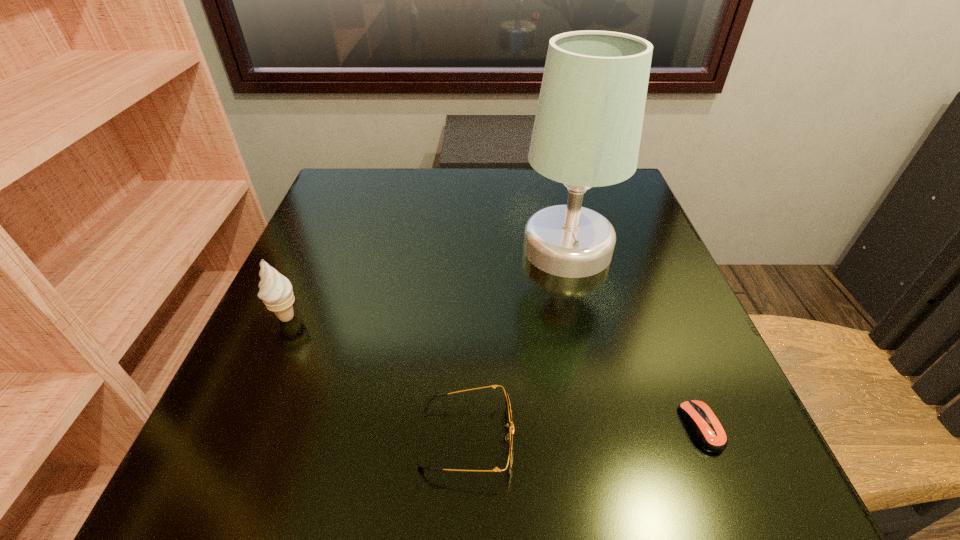
Where is `empty space that is in between the third tallest object and the leftmost object`? The width and height of the screenshot is (960, 540). empty space that is in between the third tallest object and the leftmost object is located at coordinates (376, 378).

At what (x,y) coordinates should I click in order to perform the action: click on free area in between the shortest object and the third tallest object. Please return your answer as a coordinate pair (x, y). Looking at the image, I should click on [x=584, y=433].

You are a GUI agent. You are given a task and a screenshot of the screen. Output one action in this format:
    pyautogui.click(x=<x>, y=<y>)
    Task: Click on the vacant area that lies between the third object from left to right and the second tallest object
    
    Given the screenshot: What is the action you would take?
    pyautogui.click(x=427, y=283)

Locate an element on the screen. The image size is (960, 540). free space between the rightmost object and the second farthest object is located at coordinates (494, 372).

Locate an element on the screen. The image size is (960, 540). free space between the rightmost object and the third tallest object is located at coordinates (584, 433).

Where is `free spot between the leftmost object and the farthest object`? The width and height of the screenshot is (960, 540). free spot between the leftmost object and the farthest object is located at coordinates (427, 283).

Identify which object is the third closest to the third nearest object. Please provide its 2D coordinates. Your answer should be formatted as a tuple, i.e. [(x, y)], where the tuple contains the x and y coordinates of a point satisfying the conditions above.

[(707, 430)]

Identify the location of the second closest object relative to the second object from left to right. (587, 130).

Locate an element on the screen. The height and width of the screenshot is (540, 960). vacant space that satisfies the following two spatial constraints: 1. on the base of the farthest object; 2. on the left side of the computer mouse is located at coordinates (610, 427).

I want to click on free region that satisfies the following two spatial constraints: 1. on the base of the shortest object; 2. on the right side of the lampshade, so click(610, 427).